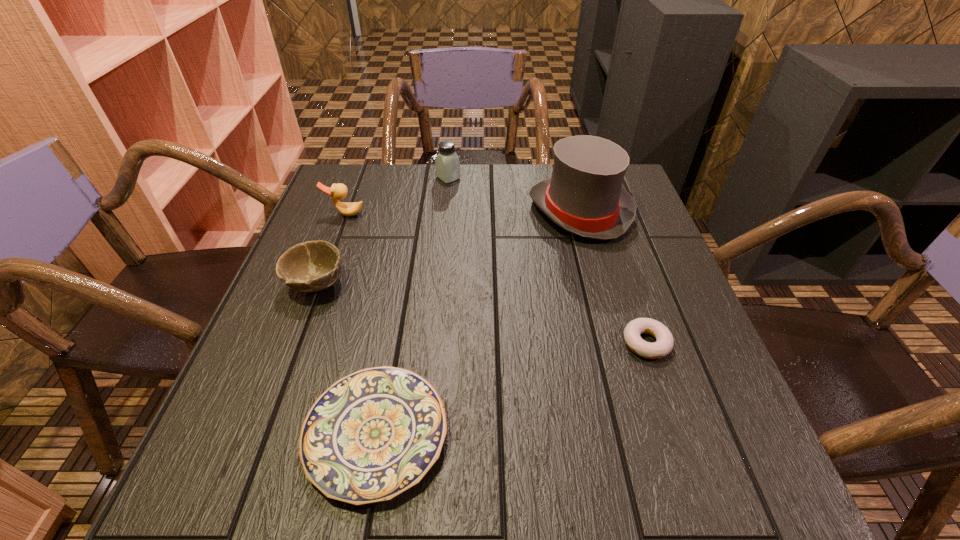
At what (x,y) coordinates should I click in order to perform the action: click on bowl present at the left edge. Please return your answer as a coordinate pair (x, y). This screenshot has width=960, height=540. Looking at the image, I should click on (312, 266).

Identify the location of plate that is positioned at the left edge. This screenshot has height=540, width=960. (372, 435).

The height and width of the screenshot is (540, 960). I want to click on dress hat present at the right edge, so click(585, 196).

You are a GUI agent. You are given a task and a screenshot of the screen. Output one action in this format:
    pyautogui.click(x=<x>, y=<y>)
    Task: Click on the doughnut that is at the right edge
    Image resolution: width=960 pixels, height=540 pixels.
    Given the screenshot: What is the action you would take?
    pyautogui.click(x=664, y=342)

Where is `object at the far left corner`? object at the far left corner is located at coordinates (338, 191).

The height and width of the screenshot is (540, 960). In order to click on object that is positioned at the near left corner in this screenshot , I will do `click(372, 435)`.

Identify the location of object positioned at the far right corner. This screenshot has height=540, width=960. (585, 196).

This screenshot has height=540, width=960. I want to click on free region at the far edge, so (450, 201).

Identify the location of vacant area at the near edge of the desktop. (412, 496).

In order to click on vacant space at the left edge of the desktop in this screenshot , I will do `click(308, 350)`.